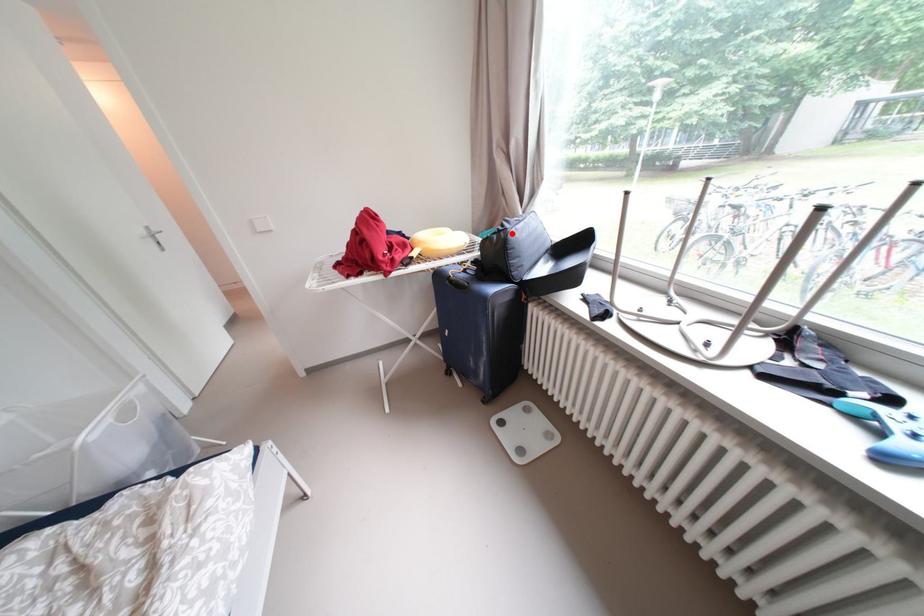
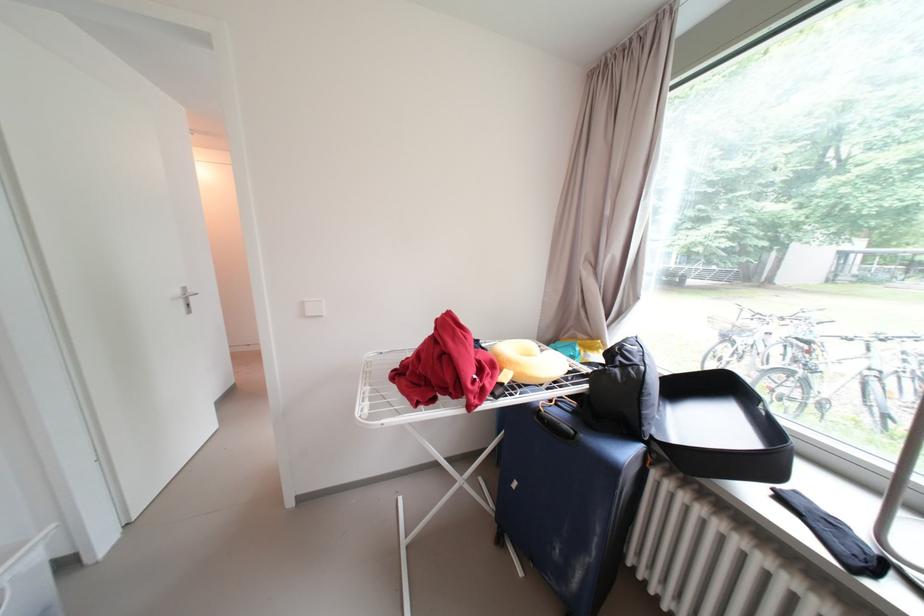
In the second image, find the point that corresponds to the highlighted location in the first image.

(640, 371)